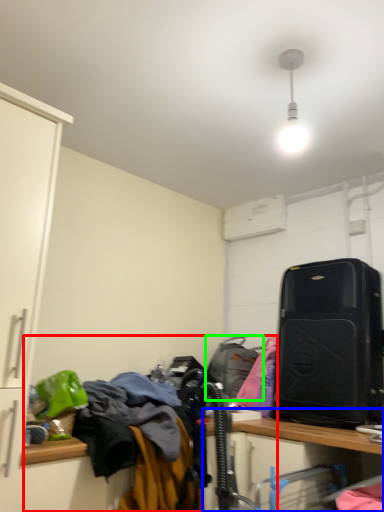
Question: Which is farther away from laundry (highlighted by a red box)? computer desk (highlighted by a blue box) or luggage and bags (highlighted by a green box)?

Choices:
 (A) computer desk
 (B) luggage and bags

Answer: (A)